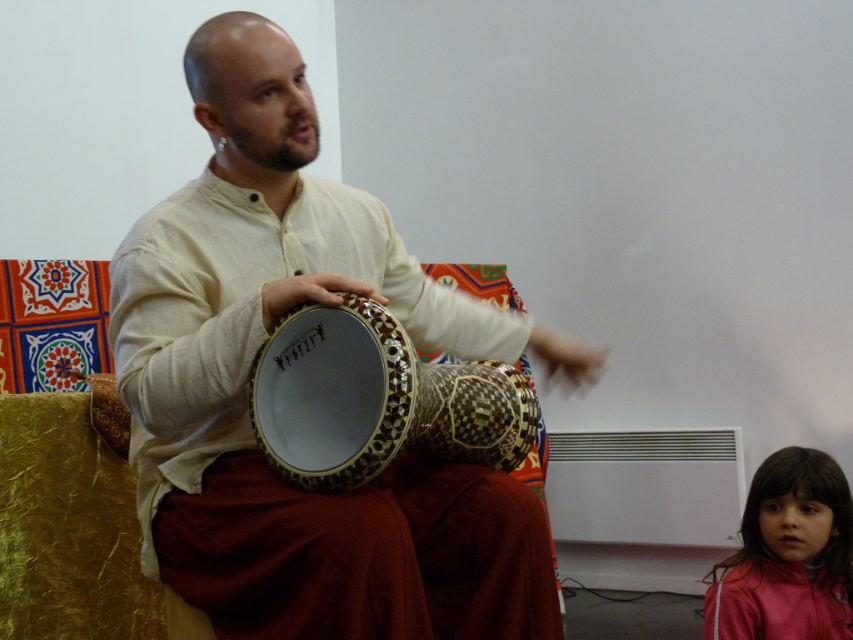
Question: Is matte wooden drum at center to the right of wooden carved drum at center from the viewer's perspective?

Choices:
 (A) no
 (B) yes

Answer: (A)

Question: From the image, what is the correct spatial relationship of wooden carved drum at center in relation to shiny pink jacket at lower right?

Choices:
 (A) left
 (B) right

Answer: (A)

Question: Which point is closer to the camera?

Choices:
 (A) shiny pink jacket at lower right
 (B) wooden carved drum at center
 (C) matte wooden drum at center

Answer: (C)

Question: Can you confirm if matte wooden drum at center is positioned above shiny pink jacket at lower right?

Choices:
 (A) yes
 (B) no

Answer: (A)

Question: Among these points, which one is farthest from the camera?

Choices:
 (A) (461, 449)
 (B) (838, 600)

Answer: (B)

Question: Which is nearer to the shiny pink jacket at lower right?

Choices:
 (A) wooden carved drum at center
 (B) matte wooden drum at center

Answer: (B)